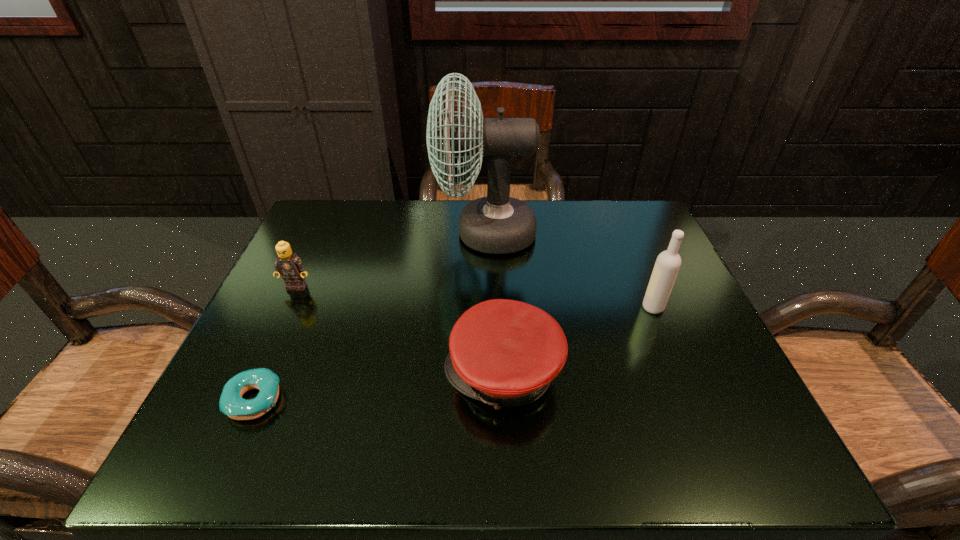
You are a GUI agent. You are given a task and a screenshot of the screen. Output one action in this format:
    pyautogui.click(x=<x>, y=<y>)
    Task: Click on the farthest object
    
    Given the screenshot: What is the action you would take?
    pyautogui.click(x=497, y=224)

You are a GUI agent. You are given a task and a screenshot of the screen. Output one action in this format:
    pyautogui.click(x=<x>, y=<y>)
    Task: Click on the fan
    
    Given the screenshot: What is the action you would take?
    pyautogui.click(x=497, y=224)

Image resolution: width=960 pixels, height=540 pixels. What are the coordinates of `vodka` in the screenshot? It's located at (667, 265).

Where is `the rightmost object`? The height and width of the screenshot is (540, 960). the rightmost object is located at coordinates (667, 265).

At what (x,y) coordinates should I click in order to perform the action: click on the third tallest object. Please return your answer as a coordinate pair (x, y). Image resolution: width=960 pixels, height=540 pixels. Looking at the image, I should click on coord(291,267).

Locate an element on the screen. This screenshot has height=540, width=960. Lego is located at coordinates pos(291,267).

The height and width of the screenshot is (540, 960). In order to click on the fourth tallest object in this screenshot , I will do [505, 353].

This screenshot has width=960, height=540. I want to click on doughnut, so click(231, 403).

At what (x,y) coordinates should I click in order to perform the action: click on vacant space located in front of the farthest object where the airflow is directed. Please return your answer as a coordinate pair (x, y). Looking at the image, I should click on (407, 233).

At what (x,y) coordinates should I click in order to perform the action: click on vacant space located 0.180m in front of the farthest object where the airflow is directed. Please return your answer as a coordinate pair (x, y). The image size is (960, 540). Looking at the image, I should click on click(x=363, y=233).